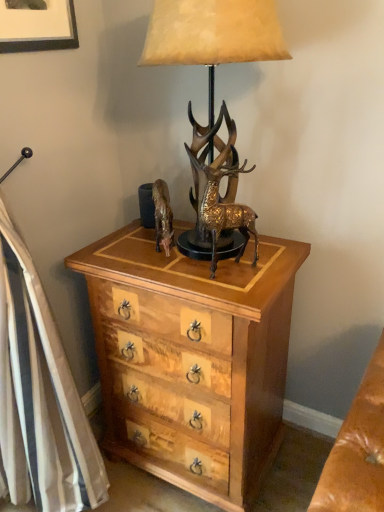
Question: Can you confirm if matte black picture frame at upper left is taller than gold textured deer at center?

Choices:
 (A) no
 (B) yes

Answer: (B)

Question: Does matte black picture frame at upper left have a larger size compared to gold textured deer at center?

Choices:
 (A) yes
 (B) no

Answer: (A)

Question: From the image's perspective, would you say matte black picture frame at upper left is shown under gold textured deer at center?

Choices:
 (A) no
 (B) yes

Answer: (A)

Question: Considering the relative positions of matte black picture frame at upper left and gold textured deer at center in the image provided, is matte black picture frame at upper left to the right of gold textured deer at center from the viewer's perspective?

Choices:
 (A) yes
 (B) no

Answer: (B)

Question: Considering the relative positions of matte black picture frame at upper left and gold textured deer at center in the image provided, is matte black picture frame at upper left to the left of gold textured deer at center from the viewer's perspective?

Choices:
 (A) yes
 (B) no

Answer: (A)

Question: Is gold metallic horse at center inside the boundaries of wooden chest of drawers at center, or outside?

Choices:
 (A) inside
 (B) outside

Answer: (B)

Question: Looking at their shapes, would you say gold metallic horse at center is wider or thinner than wooden chest of drawers at center?

Choices:
 (A) thin
 (B) wide

Answer: (A)

Question: From the image's perspective, is gold metallic horse at center above or below wooden chest of drawers at center?

Choices:
 (A) above
 (B) below

Answer: (A)

Question: Considering the positions of point [x=165, y=211] and point [x=183, y=306], is point [x=165, y=211] closer or farther from the camera than point [x=183, y=306]?

Choices:
 (A) farther
 (B) closer

Answer: (A)

Question: Is gold textured deer at center spatially inside metallic gold lamp at center, or outside of it?

Choices:
 (A) outside
 (B) inside

Answer: (B)

Question: Is point (240, 227) closer or farther from the camera than point (193, 19)?

Choices:
 (A) closer
 (B) farther

Answer: (B)

Question: Considering the positions of gold textured deer at center and metallic gold lamp at center in the image, is gold textured deer at center bigger or smaller than metallic gold lamp at center?

Choices:
 (A) small
 (B) big

Answer: (A)

Question: In the image, is gold textured deer at center positioned in front of or behind metallic gold lamp at center?

Choices:
 (A) behind
 (B) front

Answer: (A)

Question: Is wooden chest of drawers at center inside the boundaries of gold textured deer at center, or outside?

Choices:
 (A) outside
 (B) inside

Answer: (A)

Question: In terms of width, does wooden chest of drawers at center look wider or thinner when compared to gold textured deer at center?

Choices:
 (A) thin
 (B) wide

Answer: (B)